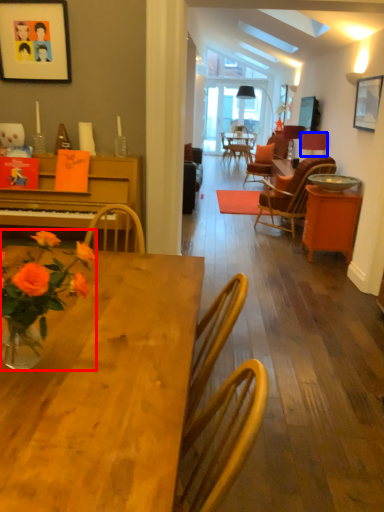
Question: Which of the following is the farthest to the observer, flower (highlighted by a red box) or lamp (highlighted by a blue box)?

Choices:
 (A) flower
 (B) lamp

Answer: (B)